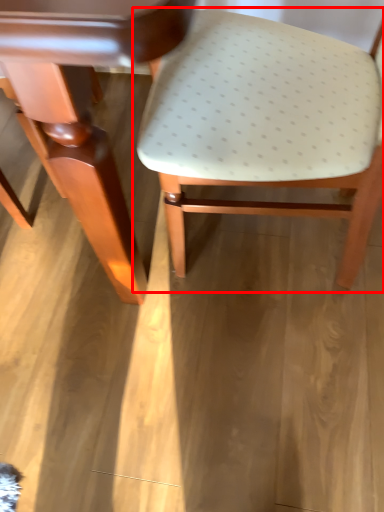
Question: Observing the image, what is the correct spatial positioning of chair (annotated by the red box) in reference to table?

Choices:
 (A) right
 (B) left

Answer: (A)